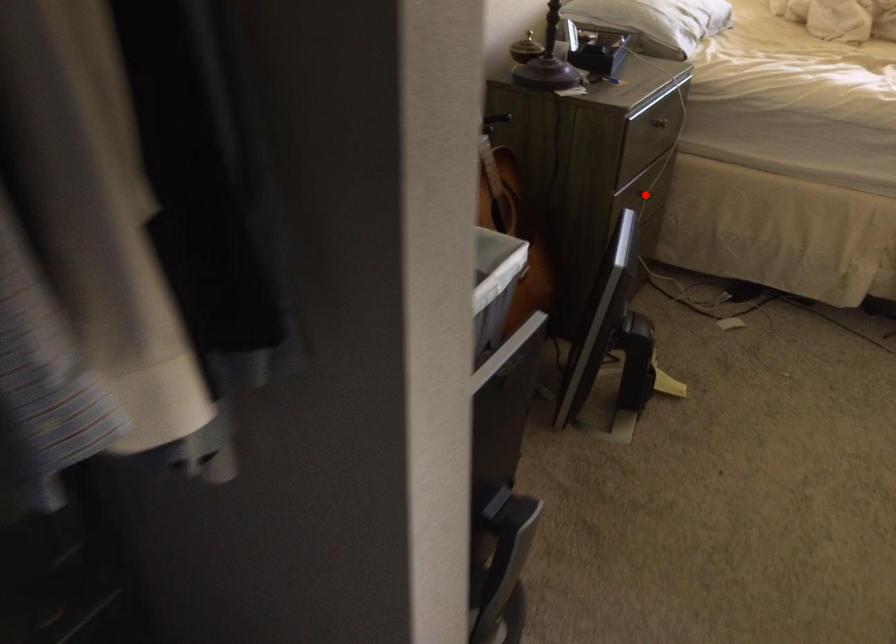
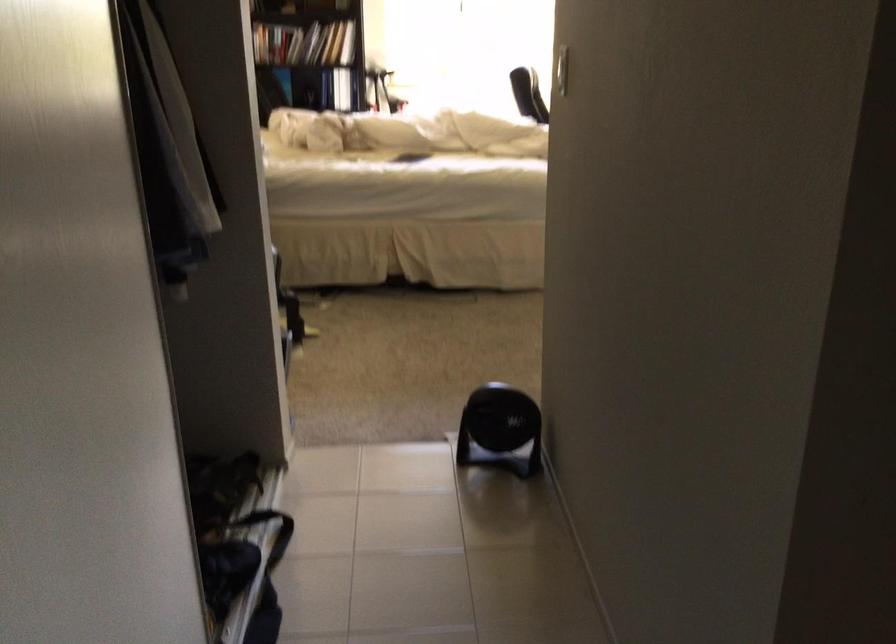
Question: I am providing you with two images of the same scene from different viewpoints. A red point is marked on the first image. Is the red point's position out of view in image 2?

Choices:
 (A) Yes
 (B) No

Answer: (A)